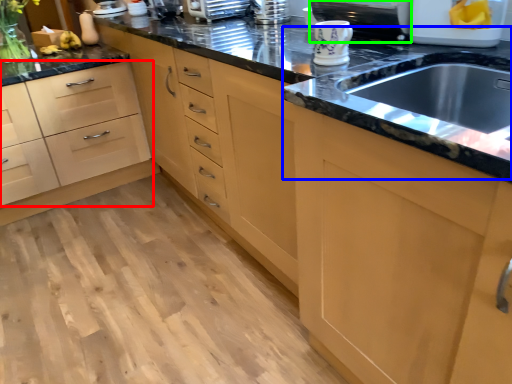
Question: Which object is the closest to the drawer (highlighted by a red box)? Choose among these: sink (highlighted by a blue box) or appliance (highlighted by a green box).

Choices:
 (A) sink
 (B) appliance

Answer: (B)